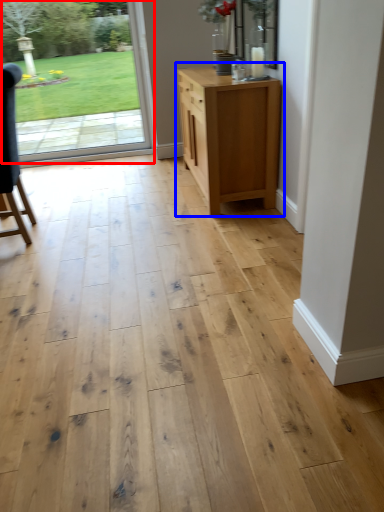
Question: Which object is further to the camera taking this photo, door (highlighted by a red box) or chest of drawers (highlighted by a blue box)?

Choices:
 (A) door
 (B) chest of drawers

Answer: (A)